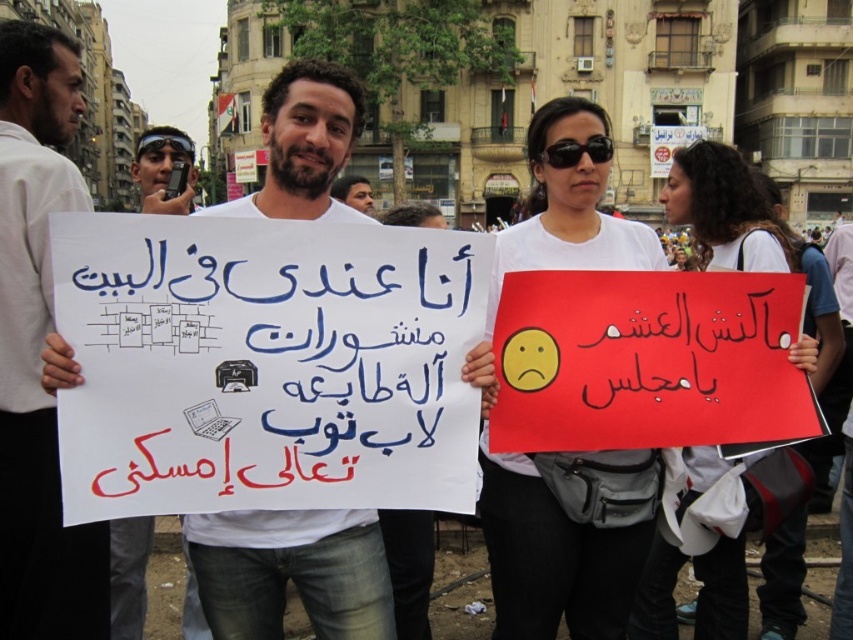
Question: Is white paper sign at left thinner than white paper sign at center?

Choices:
 (A) no
 (B) yes

Answer: (B)

Question: Which point is farther to the camera?

Choices:
 (A) black paper at center
 (B) dark brown hair at center
 (C) black plastic sunglasses at center

Answer: (B)

Question: Which point is farther from the camera taking this photo?

Choices:
 (A) (631, 390)
 (B) (3, 413)

Answer: (B)

Question: Is white paper at center further to camera compared to white paper sign at left?

Choices:
 (A) no
 (B) yes

Answer: (A)

Question: Which of the following is the farthest from the observer?

Choices:
 (A) black paper at center
 (B) black plastic sunglasses at center

Answer: (B)

Question: Is black paper at center wider than black plastic sunglasses at center?

Choices:
 (A) yes
 (B) no

Answer: (A)